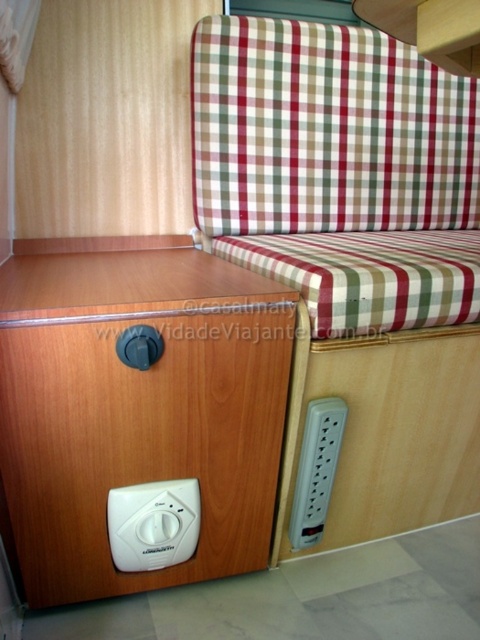
Who is more forward, (124, 486) or (300, 454)?

Point (124, 486) is more forward.

Who is more forward, (x=131, y=486) or (x=317, y=406)?

Positioned in front is point (x=131, y=486).

Where is `white plastic thermostat at lower left`? The width and height of the screenshot is (480, 640). white plastic thermostat at lower left is located at coordinates pyautogui.click(x=153, y=524).

Which is more to the left, white matte drawer at lower left or white plastic power strip at lower center?

Positioned to the left is white matte drawer at lower left.

Between point (33, 371) and point (327, 461), which one is positioned in front?

Point (33, 371) is in front.

The image size is (480, 640). Describe the element at coordinates (141, 442) in the screenshot. I see `white matte drawer at lower left` at that location.

This screenshot has height=640, width=480. In order to click on white matte drawer at lower left in this screenshot , I will do `click(141, 442)`.

Who is positioned more to the left, white matte drawer at lower left or white plastic thermostat at lower left?

white plastic thermostat at lower left

Where is `white matte drawer at lower left`? Image resolution: width=480 pixels, height=640 pixels. white matte drawer at lower left is located at coordinates (141, 442).